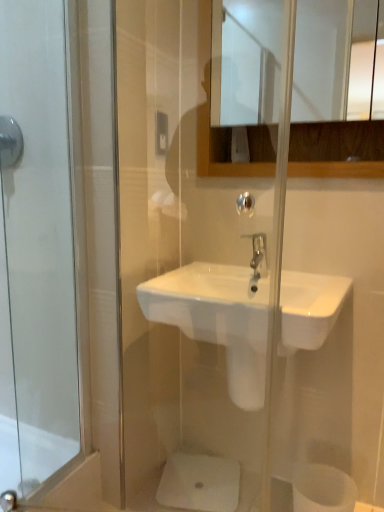
Question: Looking at their shapes, would you say brushed metal shower at upper left is wider or thinner than white matte toilet paper at lower right?

Choices:
 (A) wide
 (B) thin

Answer: (B)

Question: Would you say brushed metal shower at upper left is inside or outside white matte toilet paper at lower right?

Choices:
 (A) inside
 (B) outside

Answer: (B)

Question: Estimate the real-world distances between objects in this image. Which object is closer to the polished chrome faucet at center?

Choices:
 (A) glossy wooden mirror at upper center
 (B) brushed metal shower at upper left
 (C) white ceramic sink at center
 (D) white matte toilet paper at lower right

Answer: (C)

Question: Which object is the farthest from the white ceramic sink at center?

Choices:
 (A) white matte toilet paper at lower right
 (B) brushed metal shower at upper left
 (C) glossy wooden mirror at upper center
 (D) polished chrome faucet at center

Answer: (C)